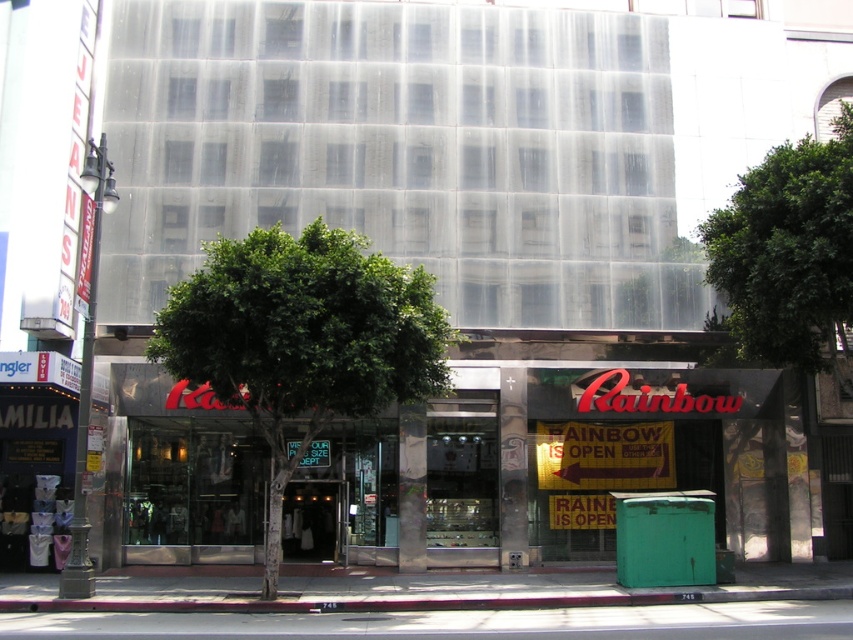
You are standing at the point marked by the coordinate (302, 340) in the image. What object is directly in front of you?

The point at coordinate (302, 340) indicates the green leafy tree at center, so the object directly in front of you is the green leafy tree at center.

You are a city planner assessing the street layout. You need to determine if the green leafy tree at center and the green leafy tree at upper right can both fit within a 10 meter wide designated planting area. Given their widths, will they fit together?

The green leafy tree at center is wider than the green leafy tree at upper right. Since their combined widths must be less than or equal to 10 meters to fit, but we don not know their exact widths, we cannot determine if they will fit together without more information.

You are a pedestrian standing in front of the commercial building. You want to walk from the green leafy tree at center to the green leafy tree at upper right. In which direction should you move?

You should move to the right because the green leafy tree at upper right is located to the right of the green leafy tree at center.